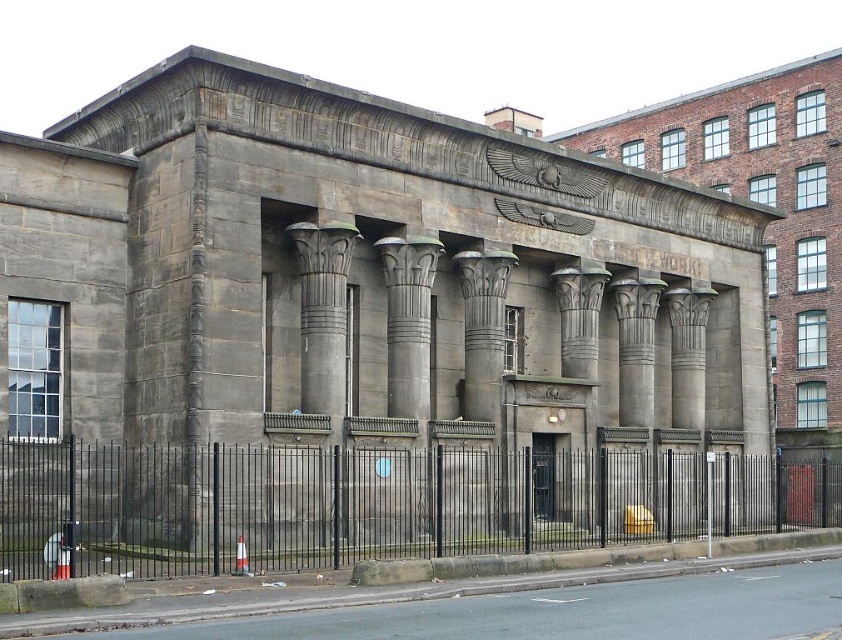
Question: Does black metal fence at lower center have a greater width compared to gray stone column at center?

Choices:
 (A) yes
 (B) no

Answer: (A)

Question: Can you confirm if black metal fence at lower center is bigger than gray stone column at center?

Choices:
 (A) yes
 (B) no

Answer: (A)

Question: Does black metal fence at lower center appear on the right side of gray stone column at center?

Choices:
 (A) yes
 (B) no

Answer: (A)

Question: Which of the following is the farthest from the observer?

Choices:
 (A) gray stone column at center
 (B) black metal fence at lower center

Answer: (A)